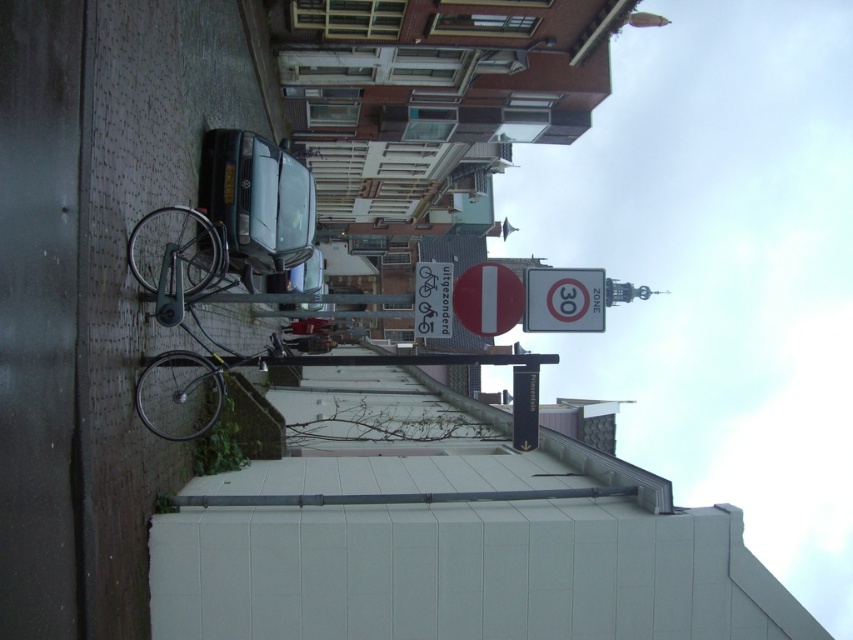
Question: Does silver metallic bicycle at left appear under white plastic sign at center?

Choices:
 (A) no
 (B) yes

Answer: (A)

Question: Which point appears closest to the camera in this image?

Choices:
 (A) (170, 276)
 (B) (439, 276)

Answer: (A)

Question: In this image, where is silver metallic speed limit sign at center located relative to white plastic sign at center?

Choices:
 (A) right
 (B) left

Answer: (A)

Question: Which point is farther from the camera taking this photo?

Choices:
 (A) tap(601, 289)
 (B) tap(415, 284)

Answer: (B)

Question: Estimate the real-world distances between objects in this image. Which object is closer to the silver metallic speed limit sign at center?

Choices:
 (A) silver metallic bicycle at left
 (B) white plastic sign at center

Answer: (B)

Question: Can you confirm if silver metallic bicycle at left is wider than white plastic sign at center?

Choices:
 (A) no
 (B) yes

Answer: (A)